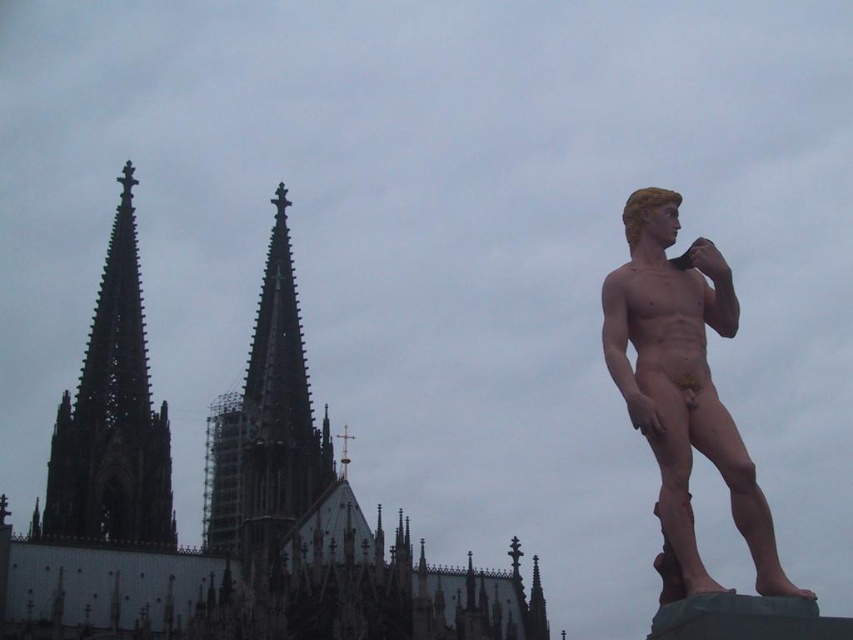
Question: Is matte bronze statue at right thinner than dark gray stone spire at upper left?

Choices:
 (A) no
 (B) yes

Answer: (B)

Question: Does matte bronze statue at right have a greater width compared to dark gray stone spire at center?

Choices:
 (A) no
 (B) yes

Answer: (A)

Question: Is dark gray stone cathedral at left further to the viewer compared to dark gray stone spire at upper left?

Choices:
 (A) yes
 (B) no

Answer: (B)

Question: Considering the real-world distances, which object is closest to the dark gray stone spire at upper left?

Choices:
 (A) dark gray stone cathedral at left
 (B) dark gray stone spire at center
 (C) matte bronze statue at right

Answer: (A)

Question: Which of these objects is positioned closest to the dark gray stone spire at upper left?

Choices:
 (A) dark gray stone spire at center
 (B) matte bronze statue at right

Answer: (A)

Question: Which of the following is the closest to the observer?

Choices:
 (A) (190, 573)
 (B) (119, 525)

Answer: (A)